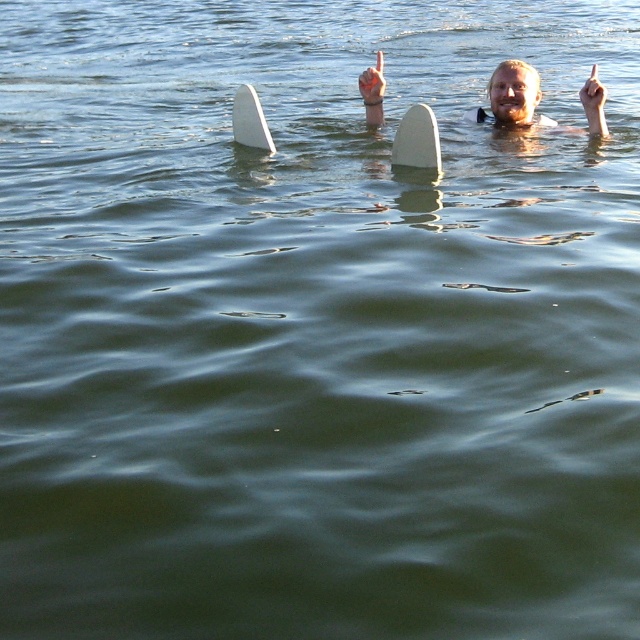
Between smooth white surfboard at upper center and white foam surfboard at center, which one is positioned higher?

smooth white surfboard at upper center is above.

Who is positioned more to the left, smooth white surfboard at upper center or white foam surfboard at center?

Positioned to the left is white foam surfboard at center.

Find the location of a particular element. Image resolution: width=640 pixels, height=640 pixels. smooth white surfboard at upper center is located at coordinates (513, 93).

Who is shorter, white matte surfboard at upper center or skinny white hand at upper center?

skinny white hand at upper center

Where is `white matte surfboard at upper center`? The image size is (640, 640). white matte surfboard at upper center is located at coordinates (250, 120).

Find the location of `white matte surfboard at upper center`. white matte surfboard at upper center is located at coordinates (250, 120).

Which is behind, point (376, 72) or point (595, 68)?

The point (376, 72) is behind.

Is point (358, 90) positioned in front of point (582, 108)?

Yes, it is.

Locate an element on the screen. skinny white hand at upper center is located at coordinates [x=372, y=83].